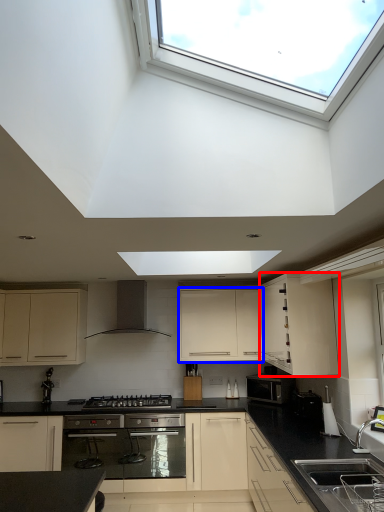
Question: Which object appears closest to the camera in this image, cabinetry (highlighted by a red box) or cabinetry (highlighted by a blue box)?

Choices:
 (A) cabinetry
 (B) cabinetry

Answer: (A)